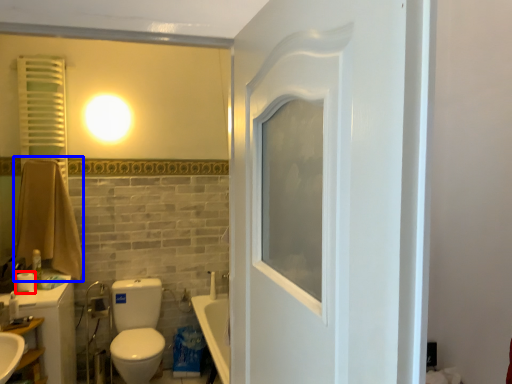
Question: Among these objects, which one is farthest to the camera, toilet paper (highlighted by a red box) or bath towel (highlighted by a blue box)?

Choices:
 (A) toilet paper
 (B) bath towel

Answer: (B)